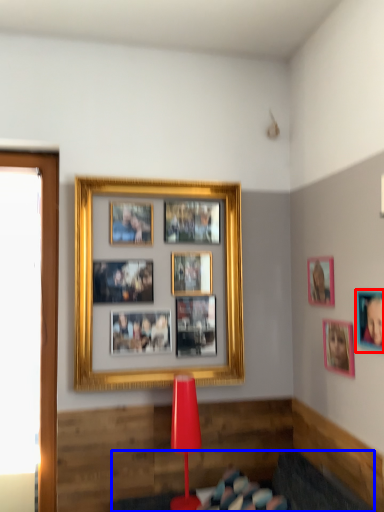
Question: Which point is further to the camera, picture frame (highlighted by a red box) or furniture (highlighted by a blue box)?

Choices:
 (A) picture frame
 (B) furniture

Answer: (A)